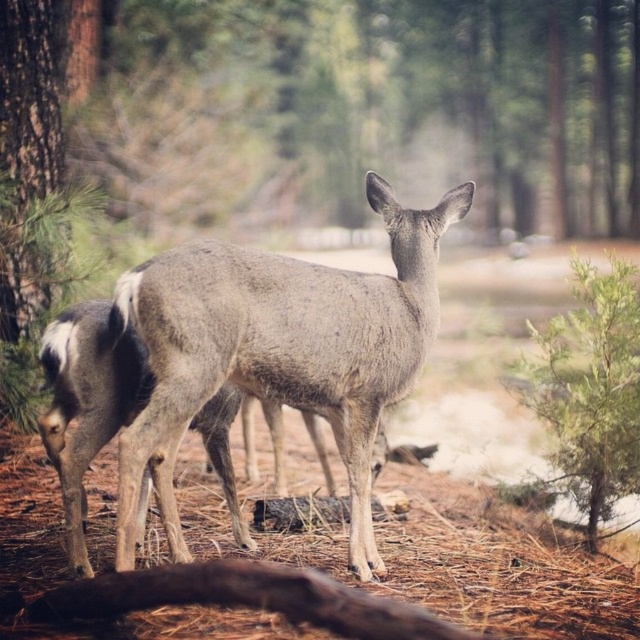
Question: Based on their relative distances, which object is farther from the fur-like gray deer at center?

Choices:
 (A) brown rough log at lower center
 (B) fur-covered deer at center

Answer: (A)

Question: Which object is positioned farthest from the fur-covered deer at center?

Choices:
 (A) fur-like gray deer at center
 (B) brown rough log at lower center

Answer: (B)

Question: Does fur-like gray deer at center have a greater width compared to brown rough log at lower center?

Choices:
 (A) yes
 (B) no

Answer: (B)

Question: Does fur-like gray deer at center have a smaller size compared to brown rough log at lower center?

Choices:
 (A) yes
 (B) no

Answer: (B)

Question: Which point is closer to the camera?

Choices:
 (A) brown rough log at lower center
 (B) fur-like gray deer at center
 (C) fur-covered deer at center

Answer: (A)

Question: Does fur-like gray deer at center have a greater width compared to brown rough log at lower center?

Choices:
 (A) yes
 (B) no

Answer: (B)